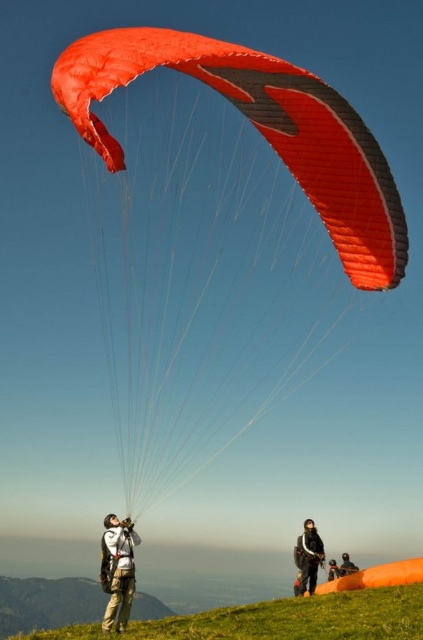
You are a pilot preparing to launch a paraglider. The orange matte parachute at upper center is currently at point 0.369, 0.518. If you want to move it to point 0.4, 0.5, which direction should you steer the paraglider?

To move the orange matte parachute at upper center from point (219, 236) to (211, 256), you should steer it slightly to the right and downward.

You are a photographer trying to capture the orange matte parachute at upper center and the black fabric jacket at lower center in the same frame. Based on their positions, which object appears larger in the photo?

The orange matte parachute at upper center appears larger in the photo because it is closer to the viewer than the black fabric jacket at lower center.

You are a paragliding instructor observing the scene. You need to ensure the distance between the orange matte parachute at upper center and the black fabric jacket at lower center is safe for takeoff. According to regulations, the minimum safe distance required is 15 meters. Is the current distance sufficient?

The orange matte parachute at upper center is 14.82 meters from the black fabric jacket at lower center. Since the minimum safe distance required is 15 meters, the current distance of 14.82 meters is insufficient for a safe takeoff.